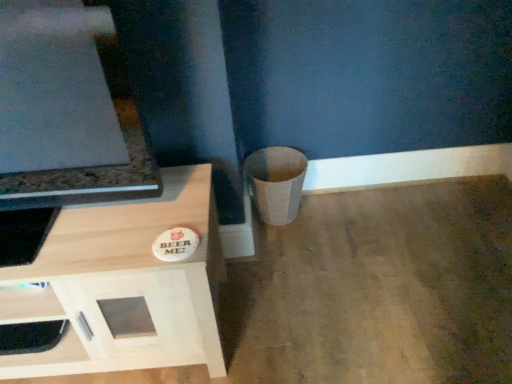
Question: Could you tell me if matte beige trash can at lower right is facing light wood cabinet at lower left?

Choices:
 (A) no
 (B) yes

Answer: (A)

Question: Is matte beige trash can at lower right not near light wood cabinet at lower left?

Choices:
 (A) yes
 (B) no

Answer: (B)

Question: Does matte beige trash can at lower right have a greater width compared to light wood cabinet at lower left?

Choices:
 (A) no
 (B) yes

Answer: (A)

Question: Considering the relative positions of matte beige trash can at lower right and light wood cabinet at lower left in the image provided, is matte beige trash can at lower right behind light wood cabinet at lower left?

Choices:
 (A) no
 (B) yes

Answer: (B)

Question: Is light wood cabinet at lower left at the back of matte beige trash can at lower right?

Choices:
 (A) no
 (B) yes

Answer: (A)

Question: Is white matte drawer at lower left wider or thinner than light wood cabinet at lower left?

Choices:
 (A) wide
 (B) thin

Answer: (B)

Question: Considering the positions of white matte drawer at lower left and light wood cabinet at lower left in the image, is white matte drawer at lower left bigger or smaller than light wood cabinet at lower left?

Choices:
 (A) big
 (B) small

Answer: (B)

Question: In terms of height, does white matte drawer at lower left look taller or shorter compared to light wood cabinet at lower left?

Choices:
 (A) tall
 (B) short

Answer: (B)

Question: Does point (15, 294) appear closer or farther from the camera than point (210, 188)?

Choices:
 (A) farther
 (B) closer

Answer: (B)

Question: Considering their positions, is matte beige trash can at lower right located in front of or behind light wood cabinet at lower left?

Choices:
 (A) behind
 (B) front

Answer: (A)

Question: Based on their sizes in the image, would you say matte beige trash can at lower right is bigger or smaller than light wood cabinet at lower left?

Choices:
 (A) big
 (B) small

Answer: (B)

Question: Is matte beige trash can at lower right wider or thinner than light wood cabinet at lower left?

Choices:
 (A) thin
 (B) wide

Answer: (A)

Question: From the image's perspective, is matte beige trash can at lower right above or below light wood cabinet at lower left?

Choices:
 (A) below
 (B) above

Answer: (B)

Question: Considering their positions, is white matte drawer at lower left located in front of or behind matte beige trash can at lower right?

Choices:
 (A) front
 (B) behind

Answer: (A)

Question: From a real-world perspective, is white matte drawer at lower left positioned above or below matte beige trash can at lower right?

Choices:
 (A) below
 (B) above

Answer: (B)